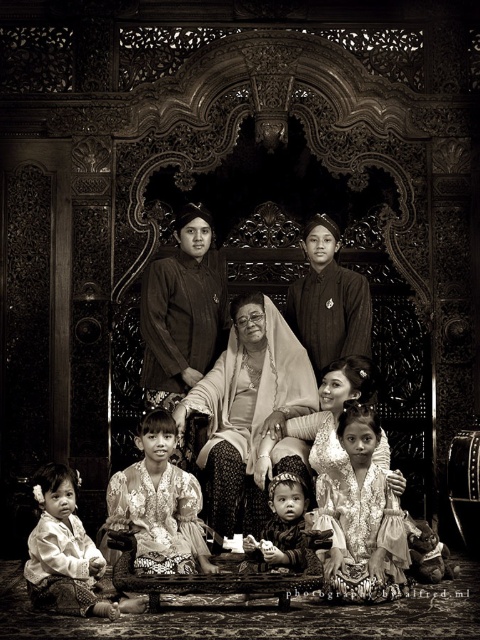
Question: Which point is closer to the camera?

Choices:
 (A) (370, 320)
 (B) (196, 228)

Answer: (A)

Question: Does matte black dress at center appear over smooth silk dress at center?

Choices:
 (A) yes
 (B) no

Answer: (A)

Question: Is silky white dress at center wider than matte white dress at lower left?

Choices:
 (A) yes
 (B) no

Answer: (B)

Question: Is silky white dress at center behind matte white dress at lower left?

Choices:
 (A) no
 (B) yes

Answer: (B)

Question: Which of the following is the closest to the observer?

Choices:
 (A) silky white dress at center
 (B) matte black dress at center
 (C) smooth silk dress at center

Answer: (A)

Question: Which object is farther from the camera taking this photo?

Choices:
 (A) silky white dress at center
 (B) silk fabric children at center
 (C) smooth silk dress at center

Answer: (C)